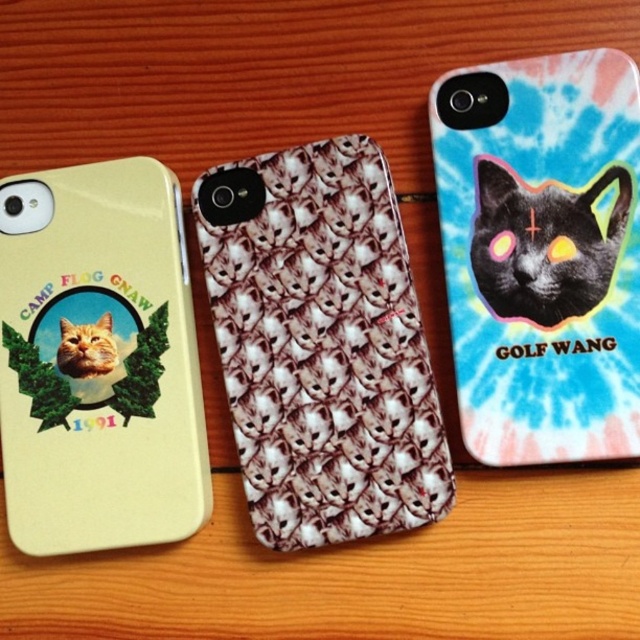
Between point (182, 369) and point (550, 250), which one is positioned behind?

The point (182, 369) is more distant.

The image size is (640, 640). Identify the location of matte yellow phone case at left. (99, 358).

Who is lower down, white textured cats at center or black glossy cat at center?

white textured cats at center

Between white textured cats at center and black glossy cat at center, which one has more height?

Standing taller between the two is white textured cats at center.

Measure the distance between point (221, 339) and camera.

1.11 meters

At what (x,y) coordinates should I click in order to perform the action: click on white textured cats at center. Please return your answer as a coordinate pair (x, y). Image resolution: width=640 pixels, height=640 pixels. Looking at the image, I should click on [x=321, y=346].

Can you confirm if white textured cats at center is positioned to the right of matte yellow phone case at left?

Indeed, white textured cats at center is positioned on the right side of matte yellow phone case at left.

Between point (333, 152) and point (211, 506), which one is positioned in front?

Point (333, 152)

Identify the location of white textured cats at center. This screenshot has height=640, width=640. (321, 346).